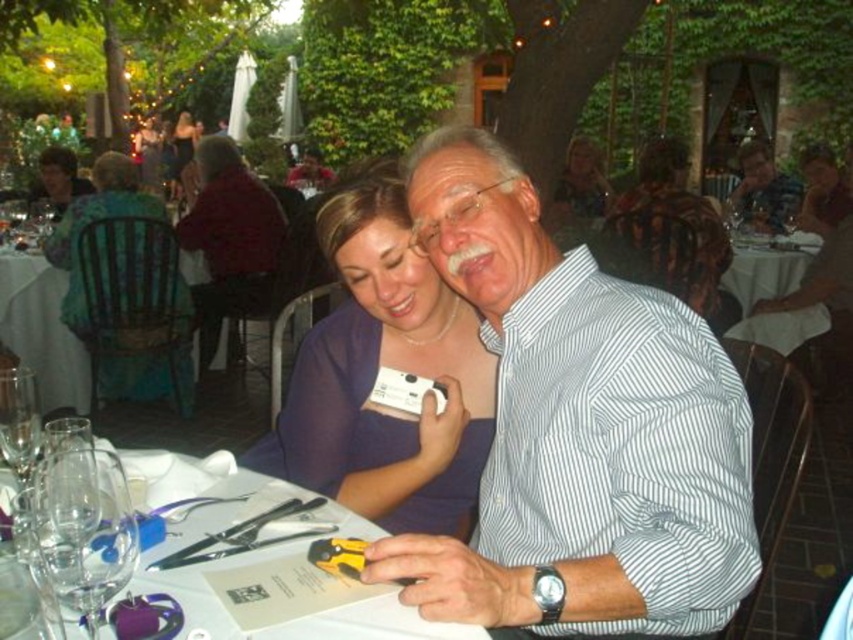
Question: Is clear glassware at center positioned behind leather jacket at center?

Choices:
 (A) no
 (B) yes

Answer: (A)

Question: Does clear glassware at center appear on the left side of matte green dress at upper left?

Choices:
 (A) yes
 (B) no

Answer: (B)

Question: Which point is farther to the camera?

Choices:
 (A) (3, 269)
 (B) (596, 182)
 (C) (51, 218)

Answer: (B)

Question: Is smooth purple dress at center smaller than matte purple dress at center?

Choices:
 (A) yes
 (B) no

Answer: (B)

Question: Which point is closer to the camera?

Choices:
 (A) smooth brown hair at upper right
 (B) matte purple dress at center

Answer: (A)

Question: Which object is closer to the camera taking this photo?

Choices:
 (A) clear glassware at center
 (B) purple satin dress at center

Answer: (A)